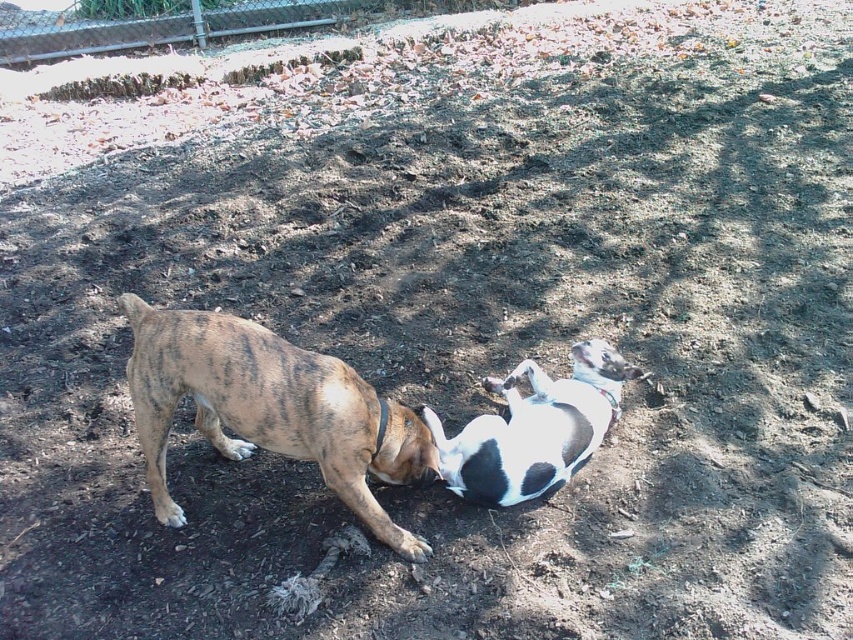
Where is `brindle fur dog at center`? The image size is (853, 640). brindle fur dog at center is located at coordinates (270, 410).

Is brindle fur dog at center above white-black fur dog at center?

No, brindle fur dog at center is not above white-black fur dog at center.

Locate an element on the screen. brindle fur dog at center is located at coordinates (270, 410).

At what (x,y) coordinates should I click in order to perform the action: click on brindle fur dog at center. Please return your answer as a coordinate pair (x, y). Looking at the image, I should click on (270, 410).